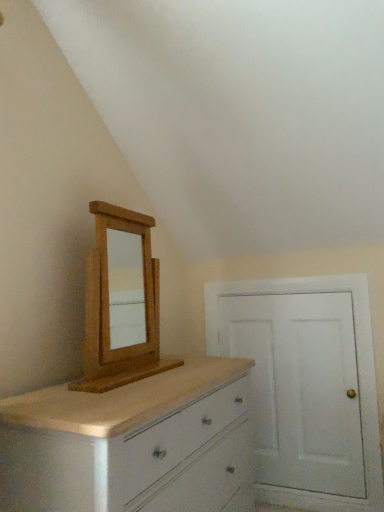
Question: Can you confirm if light brown wood medicine cabinet at upper left is positioned to the left of white painted wood chest of drawers at lower left?

Choices:
 (A) no
 (B) yes

Answer: (B)

Question: Can you confirm if light brown wood medicine cabinet at upper left is thinner than white painted wood chest of drawers at lower left?

Choices:
 (A) yes
 (B) no

Answer: (A)

Question: Is white painted wood chest of drawers at lower left at the back of light brown wood medicine cabinet at upper left?

Choices:
 (A) no
 (B) yes

Answer: (A)

Question: Is light brown wood medicine cabinet at upper left smaller than white painted wood chest of drawers at lower left?

Choices:
 (A) yes
 (B) no

Answer: (A)

Question: Can you confirm if light brown wood medicine cabinet at upper left is wider than white painted wood chest of drawers at lower left?

Choices:
 (A) yes
 (B) no

Answer: (B)

Question: Is light brown wood medicine cabinet at upper left wider or thinner than white painted wood chest of drawers at lower left?

Choices:
 (A) wide
 (B) thin

Answer: (B)

Question: From a real-world perspective, is light brown wood medicine cabinet at upper left physically located above or below white painted wood chest of drawers at lower left?

Choices:
 (A) below
 (B) above

Answer: (B)

Question: Relative to white painted wood chest of drawers at lower left, is light brown wood medicine cabinet at upper left in front or behind?

Choices:
 (A) behind
 (B) front

Answer: (A)

Question: From the image's perspective, relative to white painted wood chest of drawers at lower left, is light brown wood medicine cabinet at upper left above or below?

Choices:
 (A) below
 (B) above

Answer: (B)

Question: Is white painted wood door at right taller or shorter than light brown wood medicine cabinet at upper left?

Choices:
 (A) tall
 (B) short

Answer: (A)

Question: From a real-world perspective, is white painted wood door at right physically located above or below light brown wood medicine cabinet at upper left?

Choices:
 (A) below
 (B) above

Answer: (A)

Question: Visually, is white painted wood door at right positioned to the left or to the right of light brown wood medicine cabinet at upper left?

Choices:
 (A) left
 (B) right

Answer: (B)

Question: From the image's perspective, is white painted wood door at right located above or below light brown wood medicine cabinet at upper left?

Choices:
 (A) below
 (B) above

Answer: (A)

Question: From the image's perspective, relative to white painted wood door at right, is white painted wood chest of drawers at lower left above or below?

Choices:
 (A) below
 (B) above

Answer: (A)

Question: Relative to white painted wood door at right, is white painted wood chest of drawers at lower left in front or behind?

Choices:
 (A) front
 (B) behind

Answer: (A)